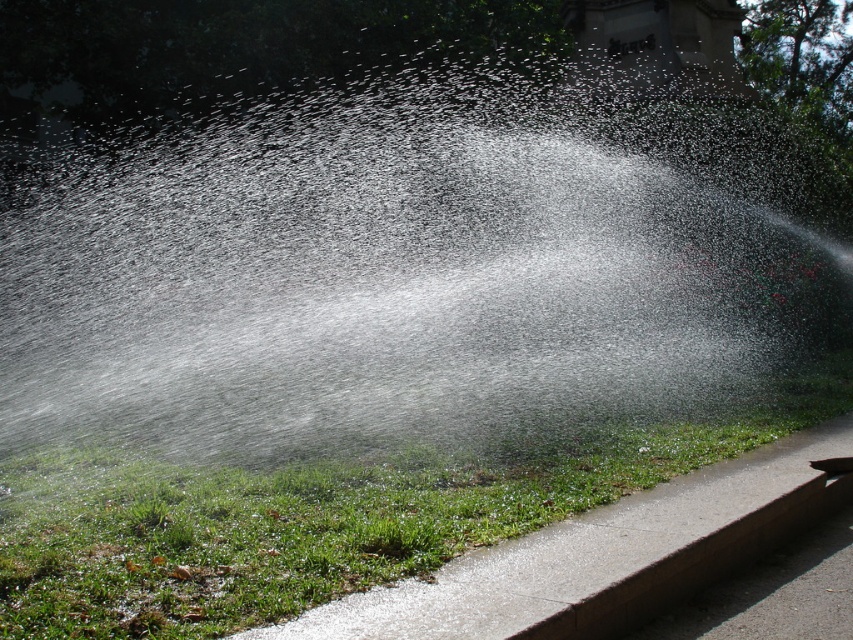
You are standing in the scene and see the point at coordinates (407, 269). What is located at that point?

The point at coordinates (407, 269) is on transparent water at center.

You are standing at the origin point of the coordinate system. Which direction should you move to reach the transparent water at center?

The transparent water at center is located at coordinate point 0.423 on the x axis and 0.478 on the y axis. Since you are at the origin, you should move towards the positive x and positive y direction to reach it.